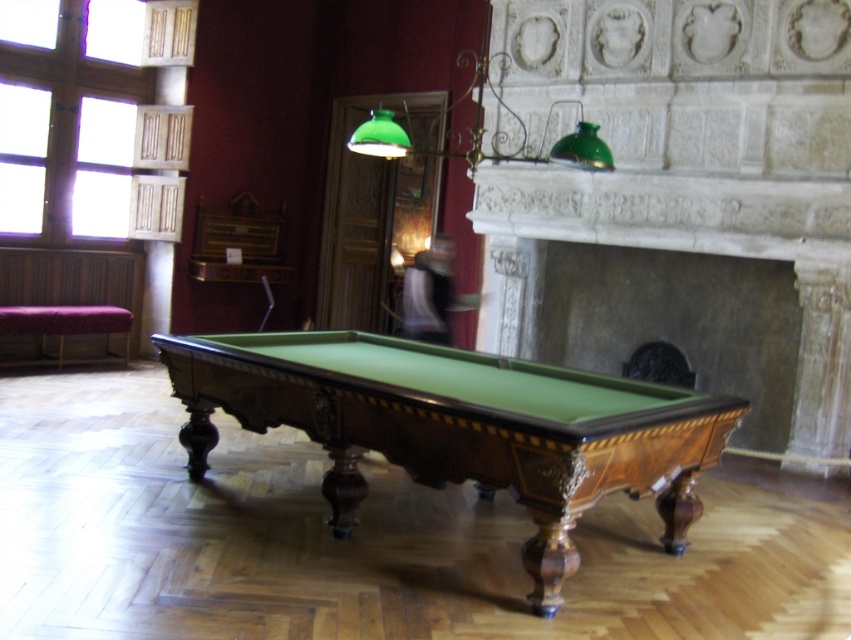
Question: Which of the following is the closest to the observer?

Choices:
 (A) white marble fireplace at center
 (B) green enameled metal wall lamp at upper center
 (C) purple fabric bench at left
 (D) green felt pool table at center

Answer: (D)

Question: Is green felt pool table at center thinner than purple fabric bench at left?

Choices:
 (A) yes
 (B) no

Answer: (B)

Question: Estimate the real-world distances between objects in this image. Which object is closer to the purple fabric bench at left?

Choices:
 (A) white marble fireplace at center
 (B) green enameled metal wall lamp at upper center

Answer: (B)

Question: Considering the relative positions of white marble fireplace at center and purple fabric bench at left in the image provided, where is white marble fireplace at center located with respect to purple fabric bench at left?

Choices:
 (A) right
 (B) left

Answer: (A)

Question: Is white marble fireplace at center bigger than green felt pool table at center?

Choices:
 (A) yes
 (B) no

Answer: (A)

Question: Estimate the real-world distances between objects in this image. Which object is farther from the green felt pool table at center?

Choices:
 (A) green enameled metal wall lamp at upper center
 (B) white marble fireplace at center

Answer: (B)